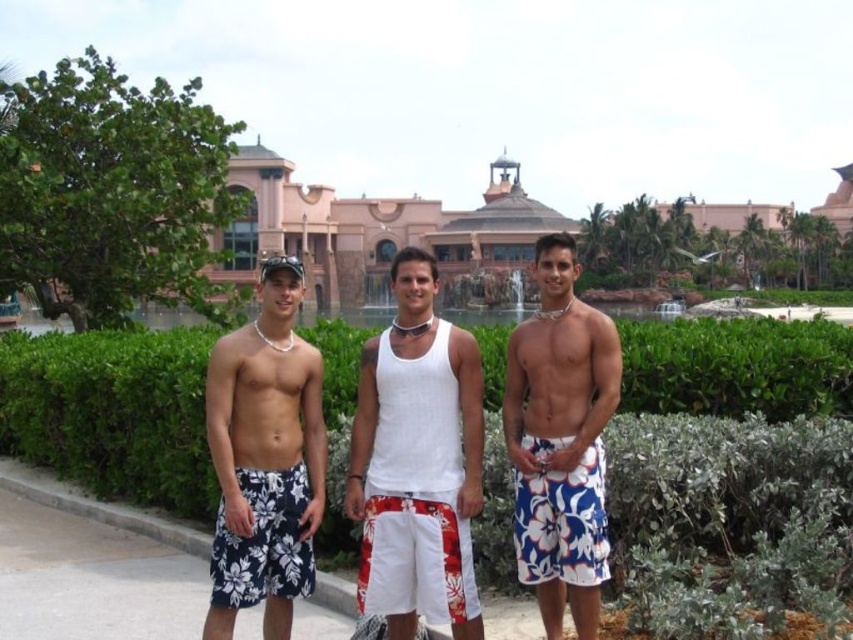
Is white fabric tank top at center positioned at the back of white floral shorts at center?

Yes, white fabric tank top at center is behind white floral shorts at center.

Is point (397, 268) positioned after point (544, 499)?

Yes, point (397, 268) is farther from viewer.

Which is in front, point (364, 579) or point (601, 477)?

Positioned in front is point (364, 579).

You are a GUI agent. You are given a task and a screenshot of the screen. Output one action in this format:
    pyautogui.click(x=<x>, y=<y>)
    Task: Click on the white fabric tank top at center
    This screenshot has width=853, height=640.
    Given the screenshot: What is the action you would take?
    pyautogui.click(x=416, y=461)

Is point (305, 493) positioned behind point (610, 362)?

That is False.

Is point (286, 460) closer to viewer compared to point (531, 410)?

Yes, point (286, 460) is in front of point (531, 410).

Where is `matte white shorts at center`? This screenshot has width=853, height=640. matte white shorts at center is located at coordinates (265, 458).

Can you confirm if white fabric tank top at center is taller than matte white shorts at center?

No, white fabric tank top at center is not taller than matte white shorts at center.

Can you confirm if white fabric tank top at center is positioned to the left of matte white shorts at center?

No, white fabric tank top at center is not to the left of matte white shorts at center.

You are a GUI agent. You are given a task and a screenshot of the screen. Output one action in this format:
    pyautogui.click(x=<x>, y=<y>)
    Task: Click on the white fabric tank top at center
    The height and width of the screenshot is (640, 853).
    Given the screenshot: What is the action you would take?
    pyautogui.click(x=416, y=461)